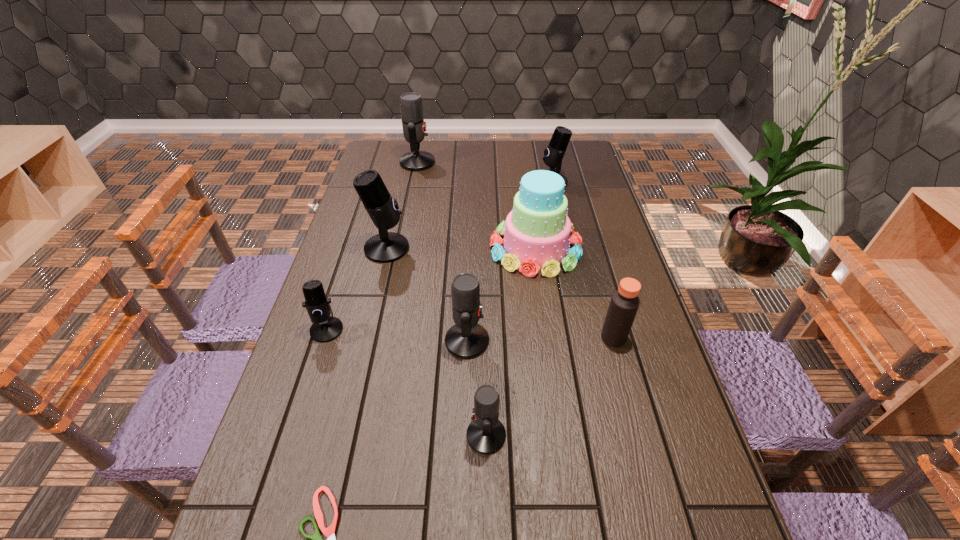
In order to click on free space located on the stand of the smallest black microphone in this screenshot , I will do `click(299, 418)`.

Identify the location of vacant space positioned 0.160m on the side of the nearest microphone with the red ring. (393, 435).

Where is `free point located 0.260m on the side of the nearest microphone with the red ring`? This screenshot has height=540, width=960. free point located 0.260m on the side of the nearest microphone with the red ring is located at coordinates (347, 435).

You are a GUI agent. You are given a task and a screenshot of the screen. Output one action in this format:
    pyautogui.click(x=<x>, y=<y>)
    Task: Click on the vacant area situated 0.190m on the side of the nearest microphone with the red ring
    Image resolution: width=960 pixels, height=540 pixels.
    Given the screenshot: What is the action you would take?
    pyautogui.click(x=378, y=435)

Locate an element on the screen. The image size is (960, 540). object at the far edge is located at coordinates (414, 128).

This screenshot has height=540, width=960. Find the location of `cake situated at the right edge`. cake situated at the right edge is located at coordinates (537, 231).

This screenshot has width=960, height=540. Identify the location of microphone present at the right edge. (553, 155).

Locate an element on the screen. This screenshot has height=540, width=960. vinegar that is at the right edge is located at coordinates (624, 303).

Identify the location of object present at the far left corner. The image size is (960, 540). (414, 128).

Locate an element on the screen. vacant space at the far edge of the desktop is located at coordinates (437, 148).